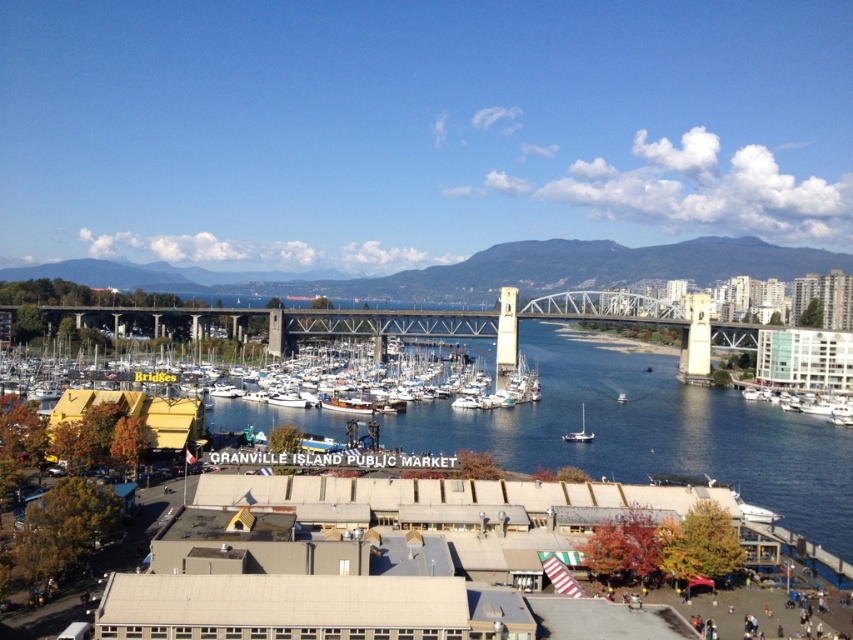
Question: Which object is closer to the camera taking this photo?

Choices:
 (A) white glossy boat at right
 (B) white matte sailboat at center-right
 (C) white matte boats at center

Answer: (C)

Question: Which point is closer to the camera?

Choices:
 (A) (844, 397)
 (B) (596, 440)
 (C) (566, 440)

Answer: (C)

Question: Does white matte sailboat at center-right appear on the left side of white matte boat at center?

Choices:
 (A) yes
 (B) no

Answer: (A)

Question: Is the position of white matte sailboat at center-right more distant than that of white matte boat at center?

Choices:
 (A) yes
 (B) no

Answer: (B)

Question: Which point is closer to the camera?

Choices:
 (A) white matte sailboat at center-right
 (B) white matte boats at center

Answer: (B)

Question: Can you confirm if white matte boats at center is positioned to the right of white glossy boat at right?

Choices:
 (A) yes
 (B) no

Answer: (B)